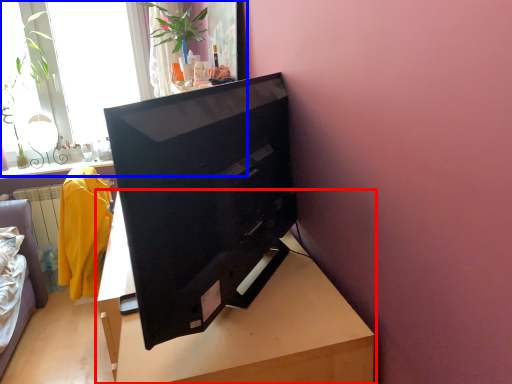
Question: Which point is further to the camera, table (highlighted by a red box) or window (highlighted by a blue box)?

Choices:
 (A) table
 (B) window

Answer: (B)